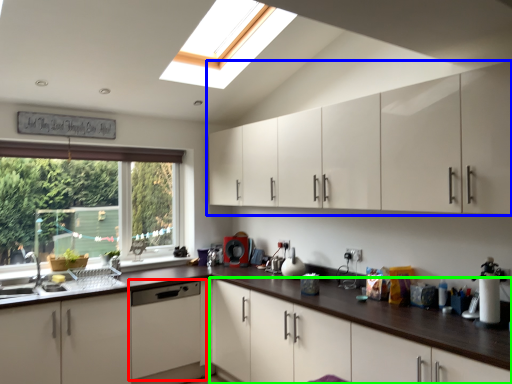
Question: Based on their relative distances, which object is farther from home appliance (highlighted by a red box)? Choose from cabinetry (highlighted by a blue box) and cabinetry (highlighted by a green box).

Choices:
 (A) cabinetry
 (B) cabinetry

Answer: (A)